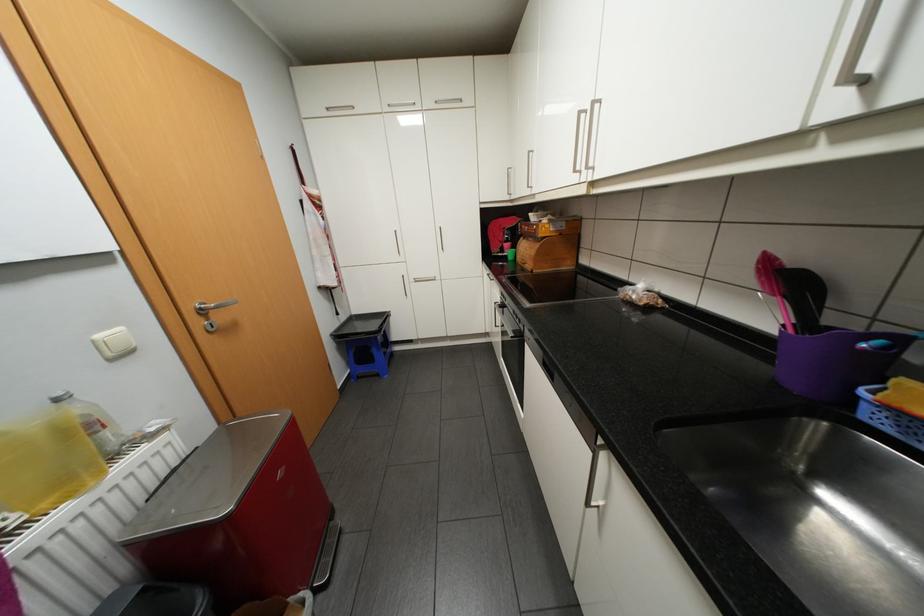
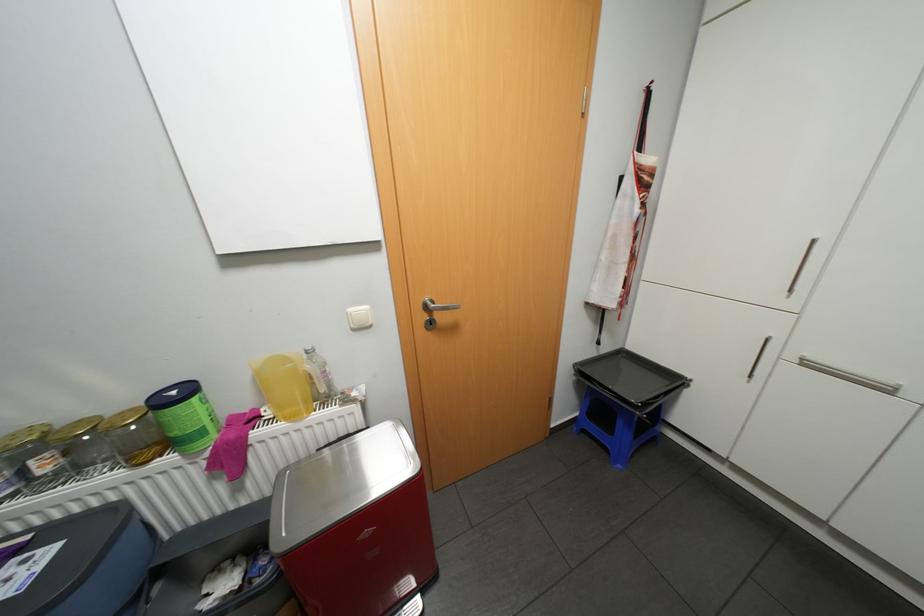
Where in the second image is the point corresponding to pixel 106 334 from the first image?

(358, 309)